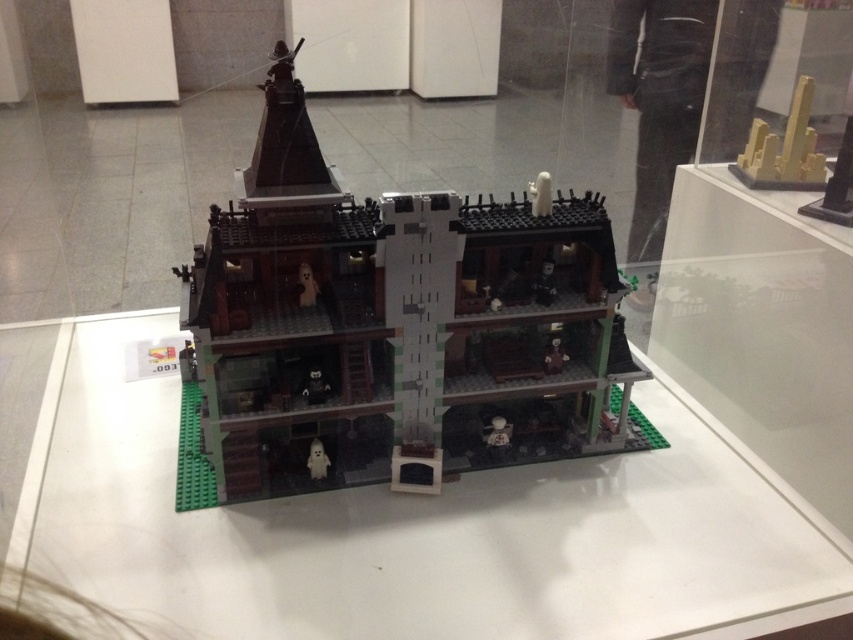
Can you confirm if brick-like lego house at center is taller than yellow matte cityscape at upper right?

Yes.

Between brick-like lego house at center and yellow matte cityscape at upper right, which one appears on the right side from the viewer's perspective?

yellow matte cityscape at upper right

Image resolution: width=853 pixels, height=640 pixels. Describe the element at coordinates (392, 326) in the screenshot. I see `brick-like lego house at center` at that location.

Find the location of `brick-like lego house at center`. brick-like lego house at center is located at coordinates (392, 326).

Is brick-like lego house at center positioned at the back of translucent white ghost at center?

No.

Which is in front, point (546, 330) or point (320, 444)?

Positioned in front is point (320, 444).

In order to click on brick-like lego house at center in this screenshot , I will do `click(392, 326)`.

Locate an element on the screen. This screenshot has height=640, width=853. brick-like lego house at center is located at coordinates (392, 326).

Can you confirm if yellow matte cityscape at upper right is smaller than translucent white ghost at center?

No, yellow matte cityscape at upper right is not smaller than translucent white ghost at center.

Is point (811, 77) positioned before point (309, 458)?

No, (811, 77) is behind (309, 458).

I want to click on yellow matte cityscape at upper right, so click(782, 150).